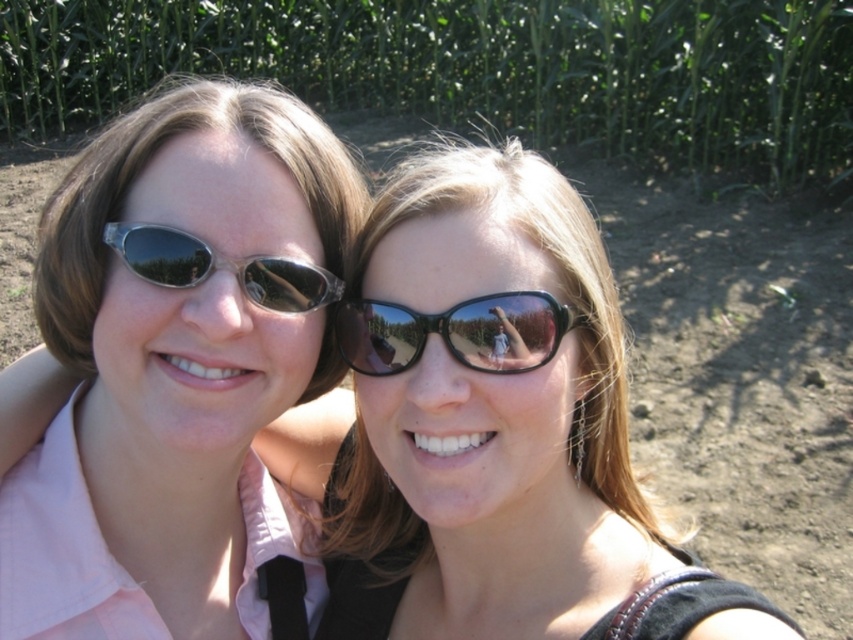
You are a photographer trying to capture a clear photo of the matte pink shirt at left and the black glossy sunglasses at center. Since both are in the frame, which object would you focus on first to ensure sharpness given their sizes?

The matte pink shirt at left is larger than the black glossy sunglasses at center, so focusing on the matte pink shirt at left first would ensure it is sharp, and the sunglasses may also be in focus due to their smaller size relative to the shirt.

From the picture: You are a photographer trying to capture the two people in the image while ensuring the green leafy corn at upper center is visible in the background. What part of the frame should you focus on to include both the subjects and the corn?

Focus on the upper center part of the frame since the green leafy corn at upper center is located there.

In the scene shown: You are a photographer trying to capture a clear shot of the matte black sunglasses at left and the green leafy corn at upper center. Which object is partially blocking the view of the other?

The matte black sunglasses at left is behind the green leafy corn at upper center, so the corn is blocking the view of the sunglasses.